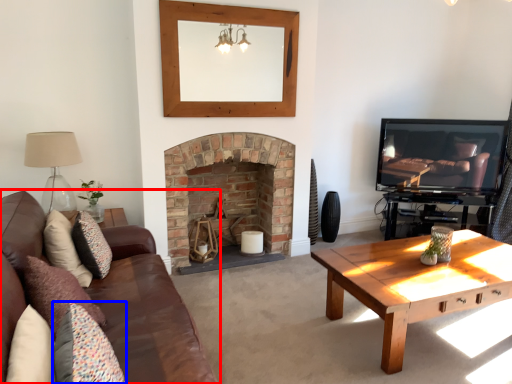
Question: Which point is closer to the camera, studio couch (highlighted by a red box) or pillow (highlighted by a blue box)?

Choices:
 (A) studio couch
 (B) pillow

Answer: (A)